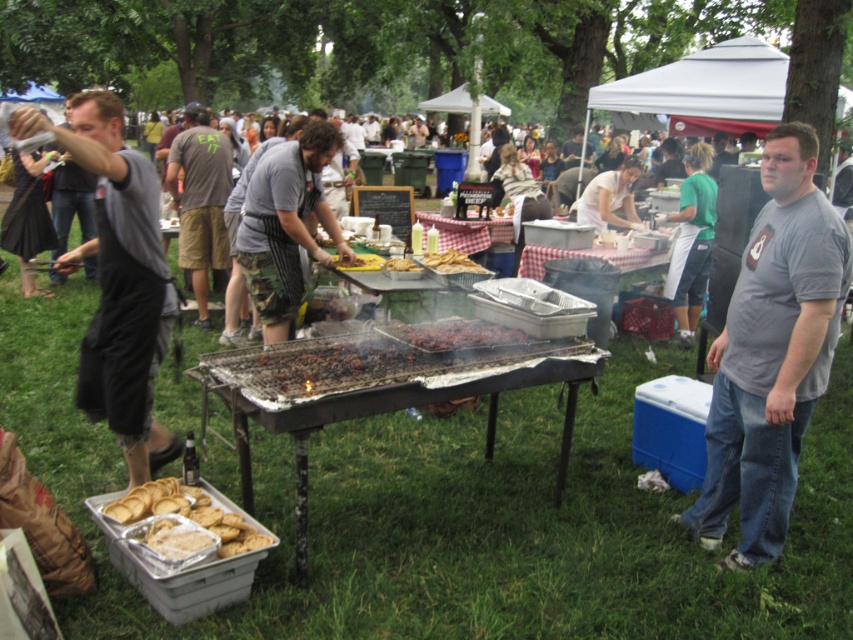
Question: Which of the following is the farthest from the observer?

Choices:
 (A) (838, 216)
 (B) (213, 234)
 (C) (198, 499)
 (D) (361, 260)

Answer: (B)

Question: Is gray cotton t-shirt at right further to the viewer compared to brown matte bread at center?

Choices:
 (A) no
 (B) yes

Answer: (A)

Question: Is dark gray t-shirt at center below brown matte bread at center?

Choices:
 (A) yes
 (B) no

Answer: (B)

Question: Among these objects, which one is nearest to the camera?

Choices:
 (A) dark gray t-shirt at center
 (B) golden brown crispy bread at lower left

Answer: (B)

Question: Considering the real-world distances, which object is farthest from the dark gray t-shirt at center?

Choices:
 (A) camo-patterned shorts at center
 (B) charcoal grill at center
 (C) golden brown crispy bread at lower left
 (D) gray fabric shirt at left

Answer: (C)

Question: Can you confirm if camo-patterned shorts at center is smaller than dark gray t-shirt at center?

Choices:
 (A) yes
 (B) no

Answer: (A)